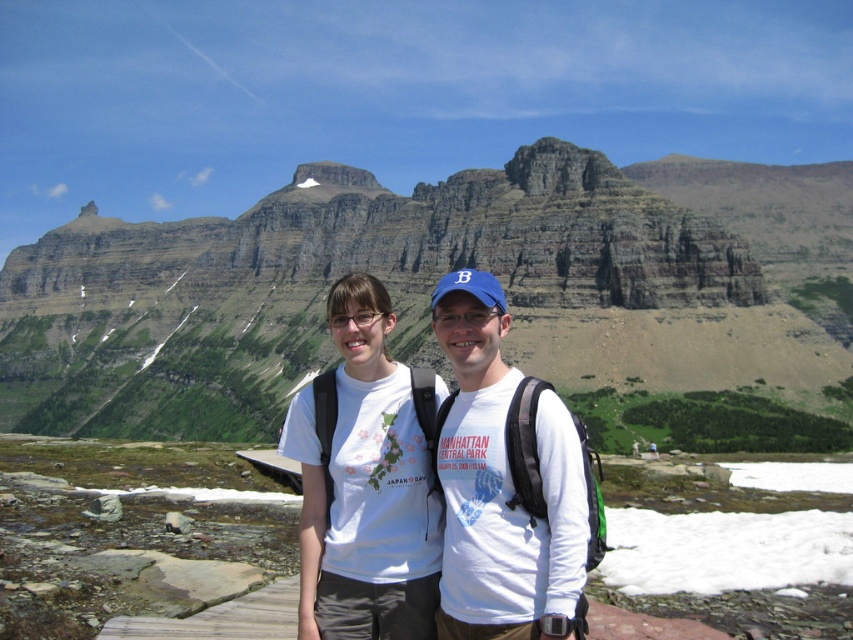
Who is more distant from viewer, (328, 204) or (463, 332)?

The point (328, 204) is behind.

Which is above, rocky cliff at center or white cotton t-shirt at center?

rocky cliff at center is higher up.

Locate an element on the screen. The height and width of the screenshot is (640, 853). rocky cliff at center is located at coordinates (431, 285).

At what (x,y) coordinates should I click in order to perform the action: click on rocky cliff at center. Please return your answer as a coordinate pair (x, y). The width and height of the screenshot is (853, 640). Looking at the image, I should click on (431, 285).